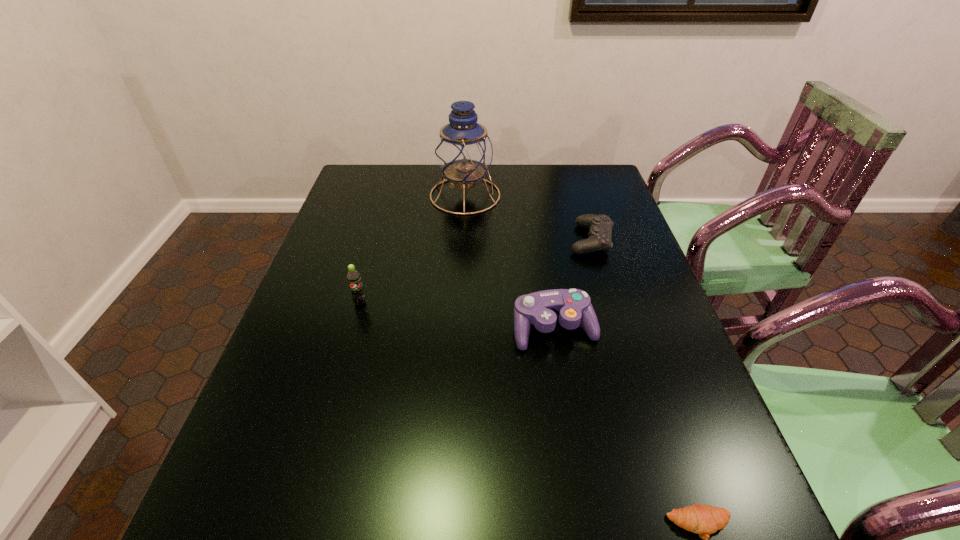
The height and width of the screenshot is (540, 960). I want to click on vacant region located 0.130m on the front of the taller control, so click(567, 404).

Where is `vacant space located on the back of the fourth nearest object`? The height and width of the screenshot is (540, 960). vacant space located on the back of the fourth nearest object is located at coordinates (581, 208).

The image size is (960, 540). Find the location of `object at the far edge`. object at the far edge is located at coordinates (464, 152).

Where is `object situated at the left edge`? object situated at the left edge is located at coordinates (353, 277).

Locate an element on the screen. The height and width of the screenshot is (540, 960). object located in the right edge section of the desktop is located at coordinates (600, 234).

The height and width of the screenshot is (540, 960). Identify the location of vacant space at the far edge. (561, 171).

In the image, there is a desktop. In order to click on vacant space at the near edge in this screenshot , I will do `click(408, 537)`.

Find the location of a particular element. blank space at the left edge of the desktop is located at coordinates (355, 210).

Image resolution: width=960 pixels, height=540 pixels. In the image, there is a desktop. What are the coordinates of `free space at the right edge` in the screenshot? It's located at (621, 242).

In the image, there is a desktop. Identify the location of free space at the near left corner. (240, 527).